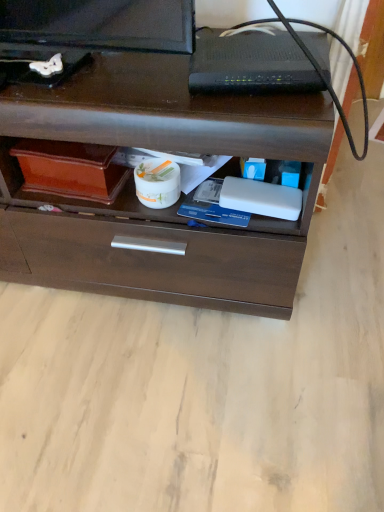
Locate an element on the screen. Image resolution: width=384 pixels, height=512 pixels. blank space above black plastic router at upper center (from a real-world perspective) is located at coordinates (247, 50).